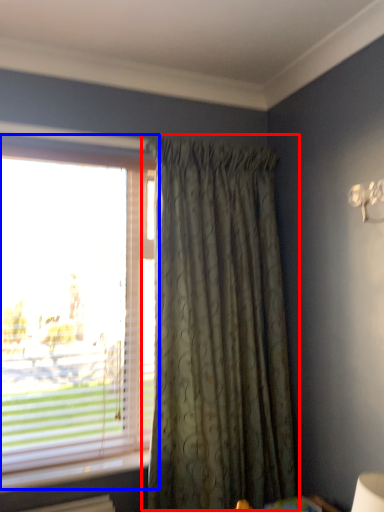
Question: Which object appears farthest to the camera in this image, curtain (highlighted by a red box) or window (highlighted by a blue box)?

Choices:
 (A) curtain
 (B) window

Answer: (B)